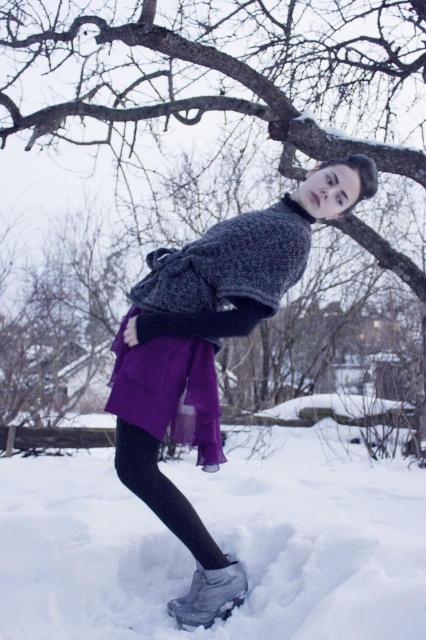
Looking at this image, between white fluffy snow at lower center and knitted gray sweater at center, which one is positioned higher?

knitted gray sweater at center is higher up.

Which is more to the right, white fluffy snow at lower center or knitted gray sweater at center?

white fluffy snow at lower center

Which is in front, point (198, 634) or point (253, 285)?

Positioned in front is point (198, 634).

This screenshot has width=426, height=640. Find the location of `white fluffy snow at lower center`. white fluffy snow at lower center is located at coordinates coord(218,541).

Between white fluffy snow at lower center and matte gray sweater at center, which one is positioned higher?

matte gray sweater at center

Between point (412, 531) and point (118, 401), which one is positioned in front?

Point (118, 401) is more forward.

Find the location of a particular element. white fluffy snow at lower center is located at coordinates (218, 541).

Find the location of `knitted gray sweater at center`. knitted gray sweater at center is located at coordinates (224, 275).

Does knitted gray sweater at center have a greater width compared to purple chiffon skirt at lower center?

Indeed, knitted gray sweater at center has a greater width compared to purple chiffon skirt at lower center.

The image size is (426, 640). In order to click on knitted gray sweater at center in this screenshot , I will do `click(224, 275)`.